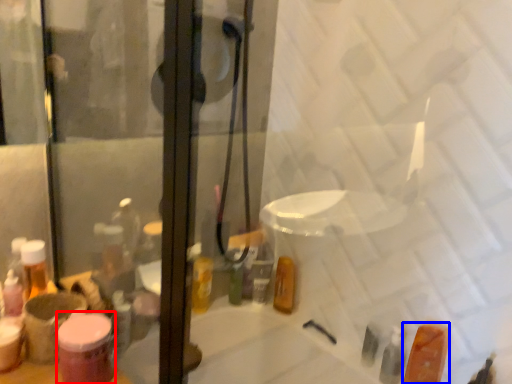
Question: Which point is further to the camera, toiletry (highlighted by a red box) or toiletry (highlighted by a blue box)?

Choices:
 (A) toiletry
 (B) toiletry

Answer: (B)